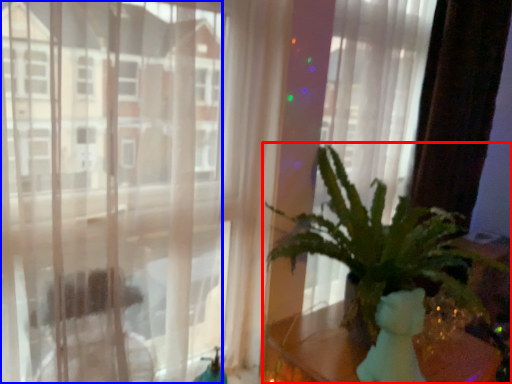
Question: Among these objects, which one is farthest to the camera, houseplant (highlighted by a red box) or window (highlighted by a blue box)?

Choices:
 (A) houseplant
 (B) window

Answer: (B)